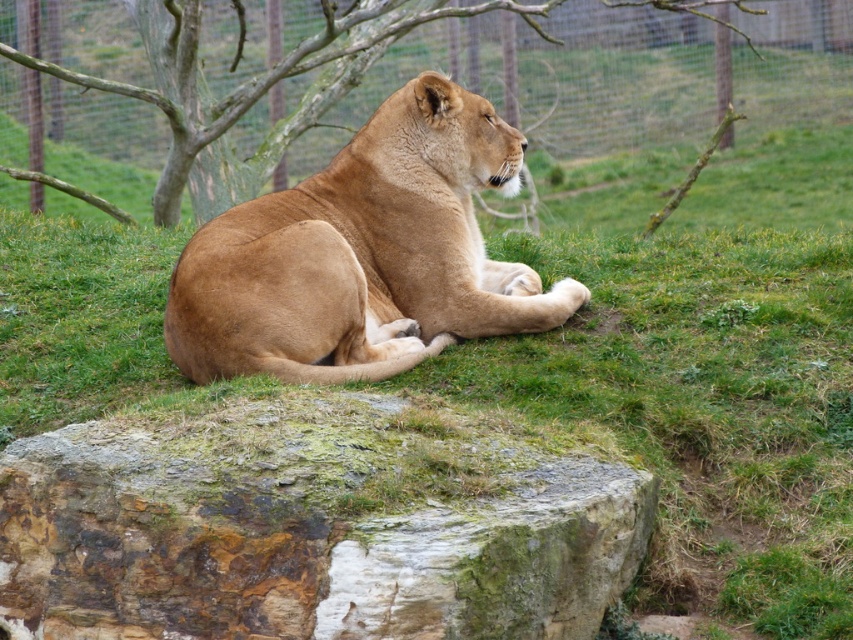
Looking at this image, does golden fur lion at center appear on the right side of brown bark tree at upper center?

Indeed, golden fur lion at center is positioned on the right side of brown bark tree at upper center.

Is golden fur lion at center smaller than brown bark tree at upper center?

Indeed, golden fur lion at center has a smaller size compared to brown bark tree at upper center.

Where is `golden fur lion at center`? The height and width of the screenshot is (640, 853). golden fur lion at center is located at coordinates (363, 253).

Between green mossy rock at lower center and brown bark tree at upper center, which one has more height?

With more height is brown bark tree at upper center.

Does green mossy rock at lower center appear under brown bark tree at upper center?

Yes.

Locate an element on the screen. The height and width of the screenshot is (640, 853). green mossy rock at lower center is located at coordinates (312, 525).

Does point (459, 516) come farther from viewer compared to point (393, 173)?

No, (459, 516) is in front of (393, 173).

What do you see at coordinates (312, 525) in the screenshot? I see `green mossy rock at lower center` at bounding box center [312, 525].

Image resolution: width=853 pixels, height=640 pixels. Find the location of `green mossy rock at lower center`. green mossy rock at lower center is located at coordinates (312, 525).